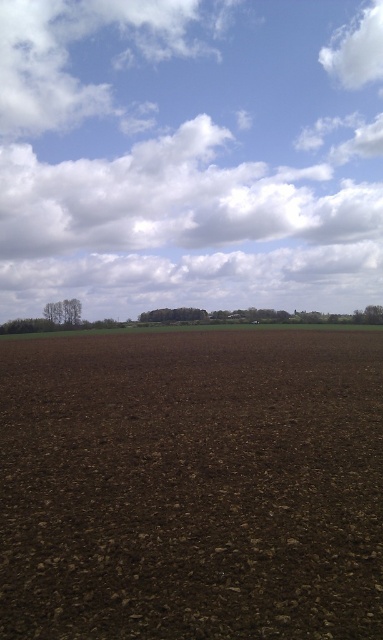
Question: Can you confirm if white fluffy clouds at upper center is positioned to the right of dark brown soil at center?

Choices:
 (A) yes
 (B) no

Answer: (B)

Question: Which is farther from the dark brown soil at center?

Choices:
 (A) white fluffy clouds at upper center
 (B) white fluffy cloud at upper right

Answer: (B)

Question: Does white fluffy clouds at upper center appear on the right side of white fluffy cloud at upper right?

Choices:
 (A) yes
 (B) no

Answer: (B)

Question: Is dark brown soil at center bigger than white fluffy cloud at upper right?

Choices:
 (A) no
 (B) yes

Answer: (A)

Question: Which is nearer to the white fluffy cloud at upper right?

Choices:
 (A) white fluffy clouds at upper center
 (B) dark brown soil at center

Answer: (A)

Question: Which point is farther to the camera?

Choices:
 (A) (356, 28)
 (B) (376, 531)
 (C) (348, 102)

Answer: (A)